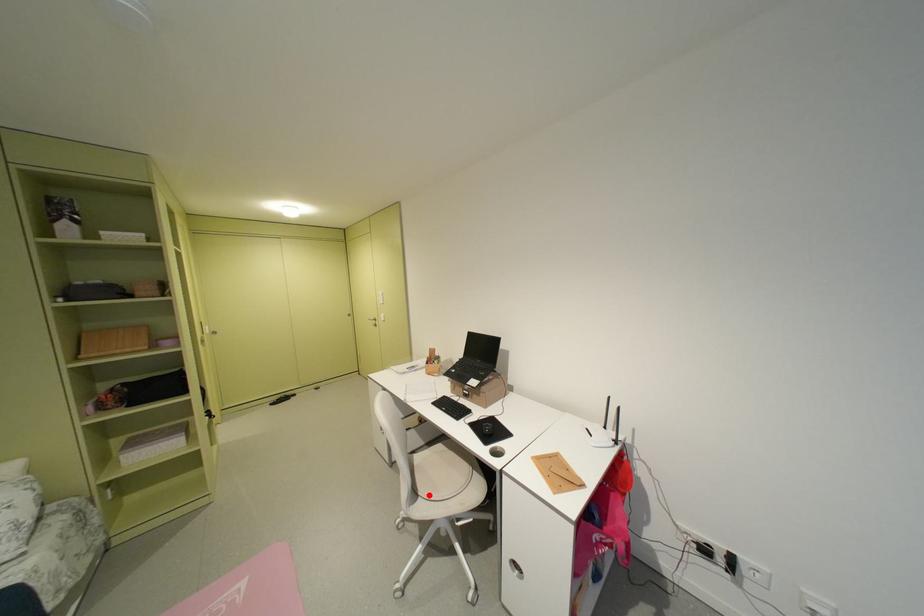
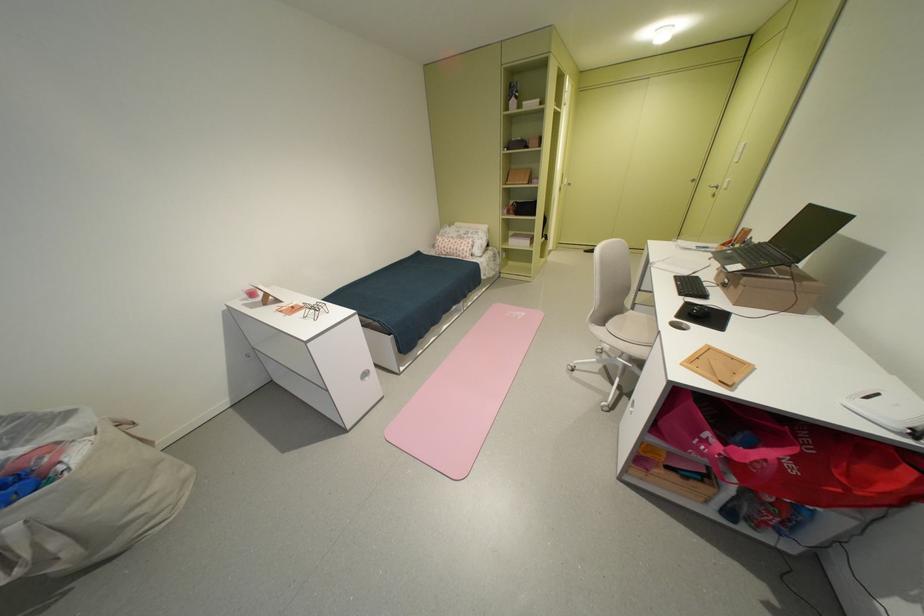
Question: I am providing you with two images of the same scene from different viewpoints. Image1 has a red point marked. In image2, the corresponding 3D location appears at what relative position? Reply with the corresponding letter.

Choices:
 (A) Closer
 (B) Farther

Answer: (B)